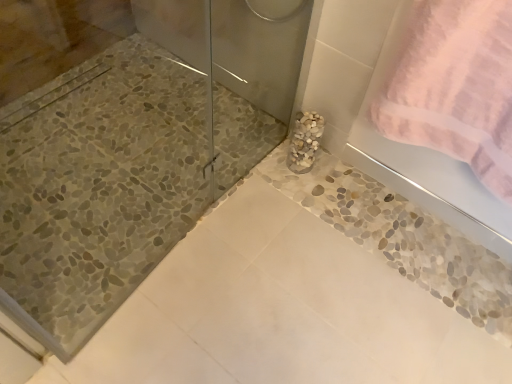
The height and width of the screenshot is (384, 512). In order to click on white pebble vase at center in this screenshot , I will do `click(305, 141)`.

The width and height of the screenshot is (512, 384). What do you see at coordinates (305, 141) in the screenshot? I see `white pebble vase at center` at bounding box center [305, 141].

This screenshot has height=384, width=512. Describe the element at coordinates (455, 87) in the screenshot. I see `pink terry cloth towel at upper right` at that location.

Identify the location of pink terry cloth towel at upper right. (455, 87).

The height and width of the screenshot is (384, 512). Find the location of `white pebble vase at center`. white pebble vase at center is located at coordinates (305, 141).

Considering the relative positions of white pebble vase at center and pink terry cloth towel at upper right in the image provided, is white pebble vase at center to the left of pink terry cloth towel at upper right from the viewer's perspective?

Yes, white pebble vase at center is to the left of pink terry cloth towel at upper right.

Considering their positions, is white pebble vase at center located in front of or behind pink terry cloth towel at upper right?

white pebble vase at center is behind pink terry cloth towel at upper right.

Does point (294, 130) appear closer or farther from the camera than point (488, 144)?

Point (294, 130) is positioned farther from the camera compared to point (488, 144).

From the image's perspective, is white pebble vase at center above pink terry cloth towel at upper right?

No, from the image's perspective, white pebble vase at center is not on top of pink terry cloth towel at upper right.

From a real-world perspective, is white pebble vase at center above or below pink terry cloth towel at upper right?

white pebble vase at center is below pink terry cloth towel at upper right.

Is white pebble vase at center wider or thinner than pink terry cloth towel at upper right?

Clearly, white pebble vase at center has less width compared to pink terry cloth towel at upper right.

From their relative heights in the image, would you say white pebble vase at center is taller or shorter than pink terry cloth towel at upper right?

white pebble vase at center is shorter than pink terry cloth towel at upper right.

Considering the relative sizes of white pebble vase at center and pink terry cloth towel at upper right in the image provided, is white pebble vase at center bigger than pink terry cloth towel at upper right?

Actually, white pebble vase at center might be smaller than pink terry cloth towel at upper right.

Is pink terry cloth towel at upper right completely or partially inside white pebble vase at center?

No, white pebble vase at center does not contain pink terry cloth towel at upper right.

Does white pebble vase at center touch pink terry cloth towel at upper right?

white pebble vase at center and pink terry cloth towel at upper right are not in contact.

Is white pebble vase at center turned away from pink terry cloth towel at upper right?

white pebble vase at center is not turned away from pink terry cloth towel at upper right.

How distant is white pebble vase at center from pink terry cloth towel at upper right?

The distance of white pebble vase at center from pink terry cloth towel at upper right is 18.01 inches.

Locate an element on the screen. marble on the left of pink terry cloth towel at upper right is located at coordinates (305, 141).

Which is more to the left, pink terry cloth towel at upper right or white pebble vase at center?

white pebble vase at center.

Which object is closer to the camera, pink terry cloth towel at upper right or white pebble vase at center?

Positioned in front is pink terry cloth towel at upper right.

Is point (461, 114) in front of point (304, 129)?

Yes, point (461, 114) is closer to viewer.

From the image's perspective, does pink terry cloth towel at upper right appear higher than white pebble vase at center?

Indeed, from the image's perspective, pink terry cloth towel at upper right is shown above white pebble vase at center.

From a real-world perspective, does pink terry cloth towel at upper right sit lower than white pebble vase at center?

No, from a real-world perspective, pink terry cloth towel at upper right is not under white pebble vase at center.

Considering the sizes of pink terry cloth towel at upper right and white pebble vase at center in the image, is pink terry cloth towel at upper right wider or thinner than white pebble vase at center?

In the image, pink terry cloth towel at upper right appears to be wider than white pebble vase at center.

Is pink terry cloth towel at upper right taller than white pebble vase at center?

Yes.

Considering the relative sizes of pink terry cloth towel at upper right and white pebble vase at center in the image provided, is pink terry cloth towel at upper right bigger than white pebble vase at center?

Correct, pink terry cloth towel at upper right is larger in size than white pebble vase at center.

Is pink terry cloth towel at upper right not within white pebble vase at center?

Yes, pink terry cloth towel at upper right is outside of white pebble vase at center.

Is pink terry cloth towel at upper right with white pebble vase at center?

No, pink terry cloth towel at upper right is not beside white pebble vase at center.

Is pink terry cloth towel at upper right oriented towards white pebble vase at center?

No, pink terry cloth towel at upper right does not turn towards white pebble vase at center.

This screenshot has height=384, width=512. What are the coordinates of `marble lying on the left of pink terry cloth towel at upper right` in the screenshot? It's located at (305, 141).

The width and height of the screenshot is (512, 384). I want to click on towel that is above the white pebble vase at center (from a real-world perspective), so click(x=455, y=87).

The image size is (512, 384). Find the location of `towel in front of the white pebble vase at center`. towel in front of the white pebble vase at center is located at coordinates (455, 87).